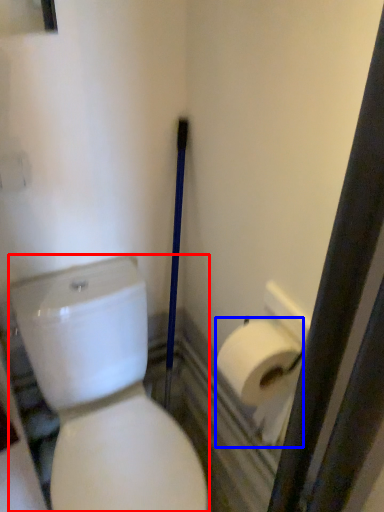
Question: Which point is further to the camera, porcelain (highlighted by a red box) or toilet paper (highlighted by a blue box)?

Choices:
 (A) porcelain
 (B) toilet paper

Answer: (B)